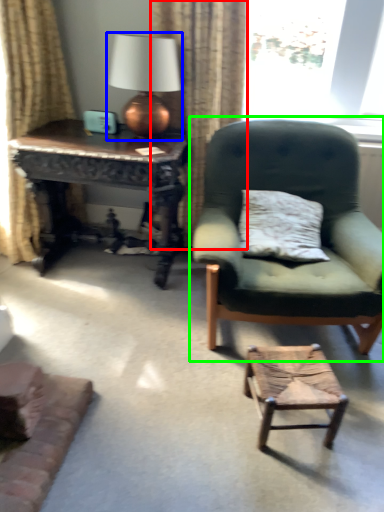
Question: Considering the real-world distances, which object is farthest from curtain (highlighted by a red box)? table lamp (highlighted by a blue box) or chair (highlighted by a green box)?

Choices:
 (A) table lamp
 (B) chair

Answer: (B)